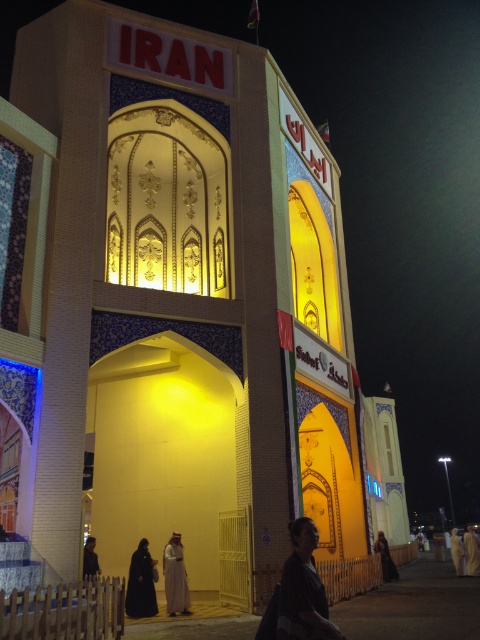
Can you confirm if dark brown leather jacket at lower center is thinner than dark fabric person at lower left?

In fact, dark brown leather jacket at lower center might be wider than dark fabric person at lower left.

Between point (316, 611) and point (85, 560), which one is positioned behind?

The point (85, 560) is more distant.

Does point (292, 627) come closer to viewer compared to point (91, 566)?

Yes.

Identify the location of dark brown leather jacket at lower center. (302, 589).

Is matte white robe at center to the right of dark fabric person at lower left from the viewer's perspective?

Indeed, matte white robe at center is positioned on the right side of dark fabric person at lower left.

Can you confirm if matte white robe at center is smaller than dark fabric person at lower left?

Incorrect, matte white robe at center is not smaller in size than dark fabric person at lower left.

Is point (188, 608) less distant than point (96, 568)?

Yes, point (188, 608) is closer to viewer.

This screenshot has height=640, width=480. I want to click on matte white robe at center, so click(x=175, y=577).

Can you confirm if white clothed person at lower right is thinner than dark fabric person at lower left?

No.

Which is in front, point (467, 570) or point (93, 547)?

Point (93, 547)

Image resolution: width=480 pixels, height=640 pixels. What are the coordinates of `white clothed person at lower right` in the screenshot? It's located at (471, 552).